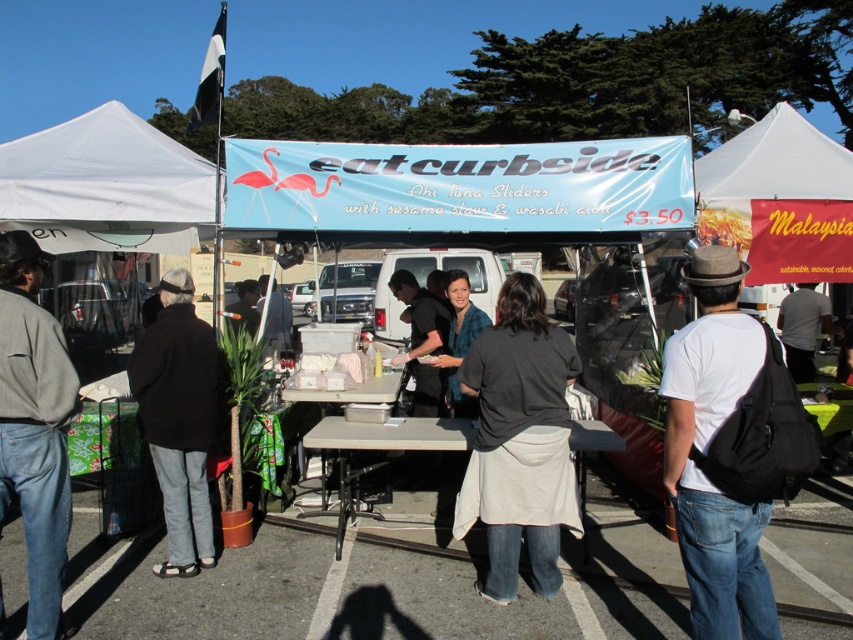
Between denim jacket at left and smooth asphalt road at center, which one appears on the right side from the viewer's perspective?

smooth asphalt road at center

Who is more distant from viewer, (33, 525) or (318, 593)?

The point (318, 593) is more distant.

I want to click on denim jacket at left, so click(x=33, y=428).

Is point (258, 218) farther from viewer compared to point (248, 326)?

No, it is not.

Does point (398, 195) lie in front of point (244, 285)?

That is True.

Which is behind, point (570, 209) or point (241, 304)?

Point (241, 304)

You are a GUI agent. You are given a task and a screenshot of the screen. Output one action in this format:
    pyautogui.click(x=<x>, y=<y>)
    Task: Click on the blue fabric banner at center
    This screenshot has height=640, width=853.
    Given the screenshot: What is the action you would take?
    pyautogui.click(x=460, y=188)

Measure the distance between black wool coat at left and camera.

black wool coat at left is 4.21 meters from camera.

Between point (155, 378) and point (456, 316), which one is positioned behind?

The point (456, 316) is behind.

Measure the distance between black wool coat at left and camera.

The distance of black wool coat at left from camera is 13.80 feet.

Find the location of a particular element. black wool coat at left is located at coordinates (178, 419).